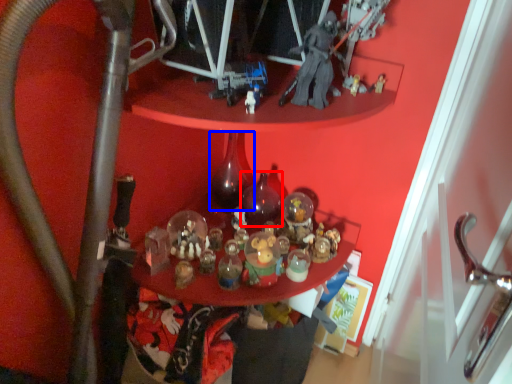
Question: Which of the following is the closest to the observer, bottle (highlighted by a red box) or bottle (highlighted by a blue box)?

Choices:
 (A) bottle
 (B) bottle

Answer: (B)